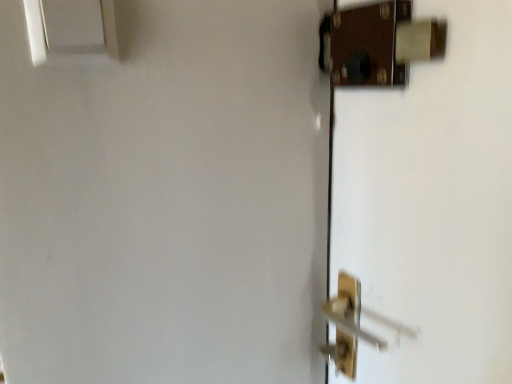
What do you see at coordinates (70, 28) in the screenshot?
I see `white plastic light switch at upper left` at bounding box center [70, 28].

Locate an element on the screen. The width and height of the screenshot is (512, 384). white plastic light switch at upper left is located at coordinates (x=70, y=28).

Find the location of a particular element. The height and width of the screenshot is (384, 512). white plastic light switch at upper left is located at coordinates (70, 28).